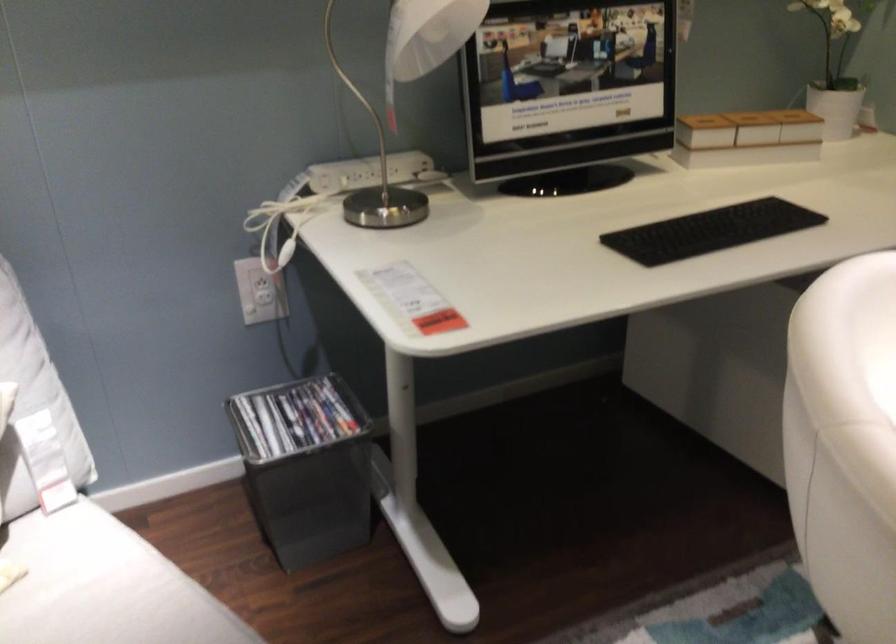
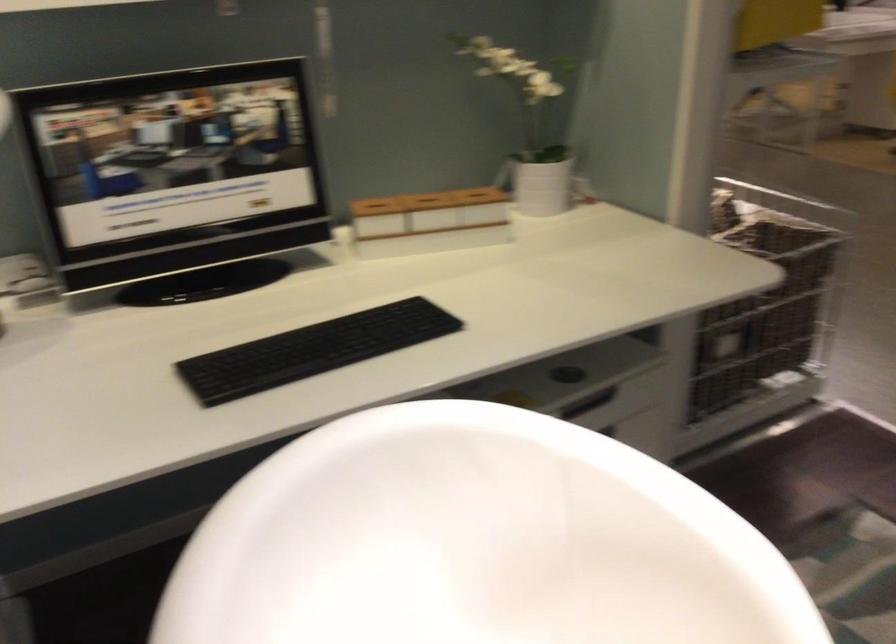
Question: The images are taken continuously from a first-person perspective. In which direction is your viewpoint rotating?

Choices:
 (A) Left
 (B) Right
 (C) Up
 (D) Down

Answer: (B)